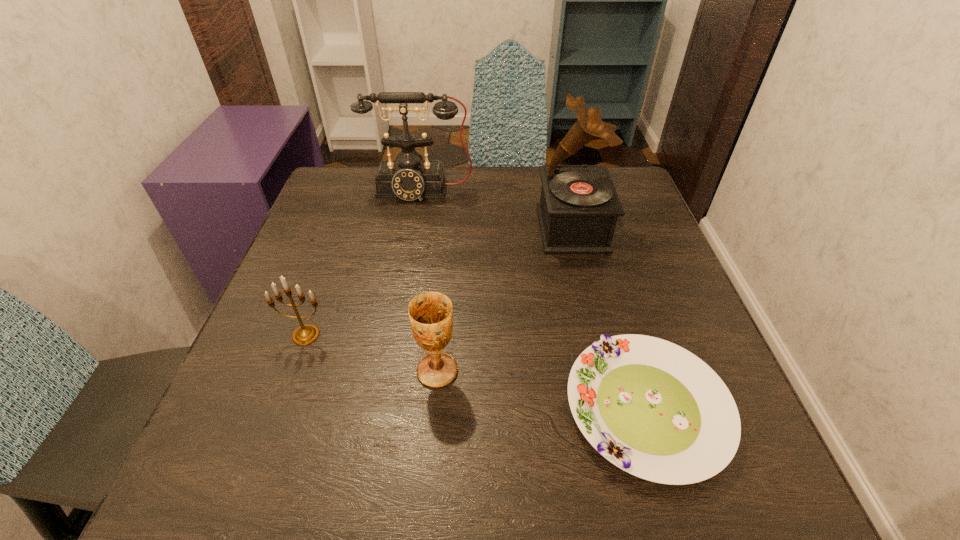
Where is `salad plate present at the right edge`? The width and height of the screenshot is (960, 540). salad plate present at the right edge is located at coordinates (652, 408).

The width and height of the screenshot is (960, 540). In order to click on object that is at the far left corner in this screenshot , I will do `click(409, 177)`.

The image size is (960, 540). I want to click on object located at the far right corner, so click(x=579, y=206).

This screenshot has width=960, height=540. I want to click on object that is positioned at the near right corner, so click(x=652, y=408).

Locate an element on the screen. free point at the far edge is located at coordinates (455, 195).

The height and width of the screenshot is (540, 960). I want to click on free region at the left edge, so click(305, 350).

The width and height of the screenshot is (960, 540). What are the coordinates of `vacant space at the right edge of the desktop` in the screenshot? It's located at (637, 307).

This screenshot has height=540, width=960. I want to click on vacant area at the far left corner of the desktop, so click(x=339, y=173).

This screenshot has width=960, height=540. Find the location of `free location at the near left corner of the desktop`. free location at the near left corner of the desktop is located at coordinates (282, 450).

You are a GUI agent. You are given a task and a screenshot of the screen. Output one action in this format:
    pyautogui.click(x=<x>, y=<y>)
    Task: Click on the vacant space that's between the candelabrum and the second tallest object
    The height and width of the screenshot is (540, 960).
    Given the screenshot: What is the action you would take?
    pyautogui.click(x=363, y=262)